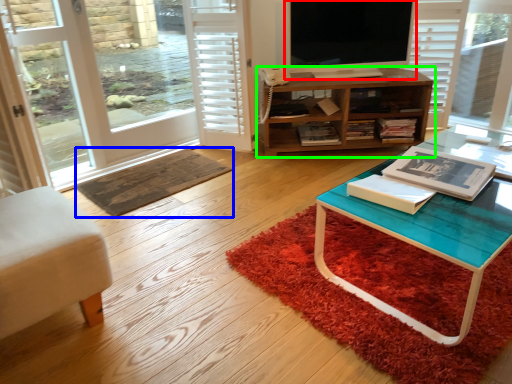
Question: Which object is positioned closest to television (highlighted by a red box)? Select from doormat (highlighted by a blue box) and cabinetry (highlighted by a green box).

Choices:
 (A) doormat
 (B) cabinetry

Answer: (B)